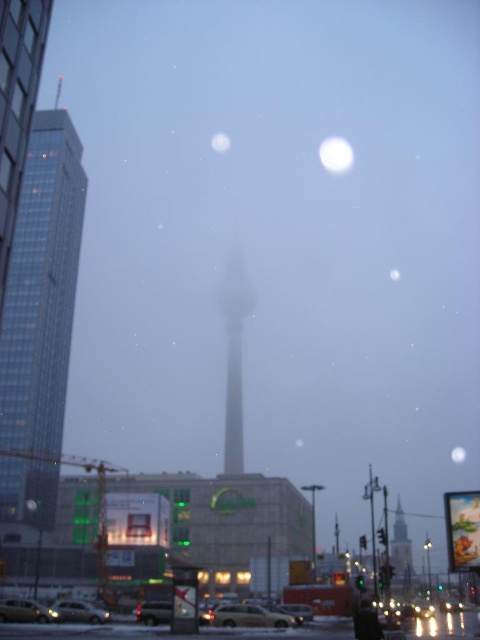
Question: Is matte silver sedan at lower left positioned before white glossy moon at center?

Choices:
 (A) yes
 (B) no

Answer: (A)

Question: Does glassy skyscraper at left appear on the right side of matte silver sedan at lower left?

Choices:
 (A) no
 (B) yes

Answer: (A)

Question: Considering the real-world distances, which object is farthest from the stone tower at center?

Choices:
 (A) white matte moon at upper center
 (B) matte silver sedan at lower left
 (C) white glossy moon at upper center

Answer: (C)

Question: Which point is farther to the camera?

Choices:
 (A) (240, 321)
 (B) (153, 602)

Answer: (A)

Question: Does matte silver sedan at lower left appear under white glossy moon at center?

Choices:
 (A) yes
 (B) no

Answer: (B)

Question: Which object is farther from the camera taking this photo?

Choices:
 (A) white matte moon at upper center
 (B) white glossy moon at upper center

Answer: (B)